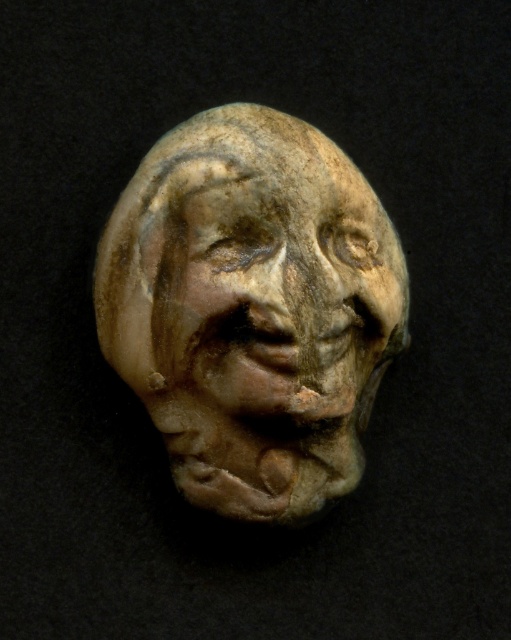
Image resolution: width=511 pixels, height=640 pixels. In order to click on matte clay bust at center in this screenshot , I will do (x=251, y=308).

Is point (205, 200) farther from viewer compared to point (215, 172)?

No, (205, 200) is closer to viewer.

Where is `matte clay bust at center`? matte clay bust at center is located at coordinates (251, 308).